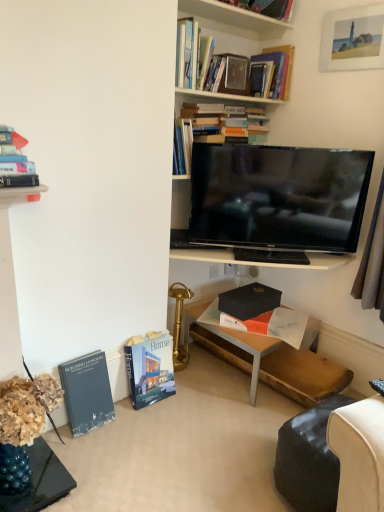
At what (x,y) coordinates should I click in order to perform the action: click on free region under black glossy tv at upper center (from a real-world perspective). Please return your answer as a coordinate pair (x, y). Image resolution: width=384 pixels, height=512 pixels. Looking at the image, I should click on (272, 259).